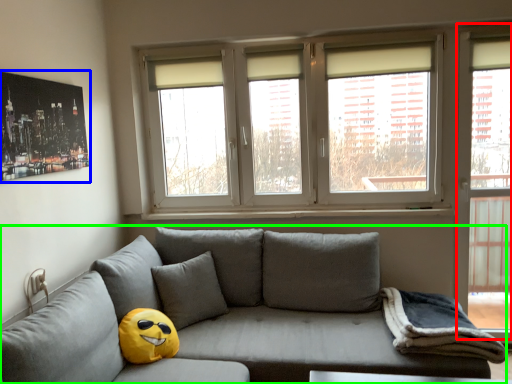
Question: Which is nearer to the glass door (highlighted by a red box)? picture frame (highlighted by a blue box) or studio couch (highlighted by a green box).

Choices:
 (A) picture frame
 (B) studio couch

Answer: (B)